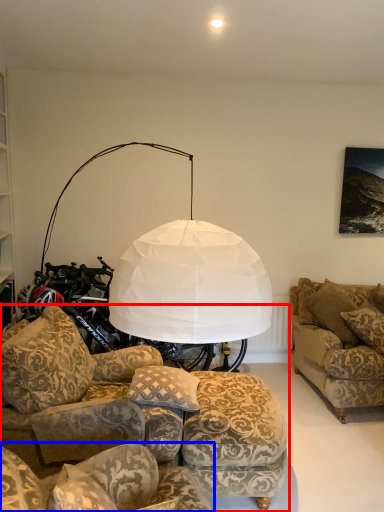
Question: Which object is closer to the camera taking this photo, studio couch (highlighted by a red box) or studio couch (highlighted by a blue box)?

Choices:
 (A) studio couch
 (B) studio couch

Answer: (A)